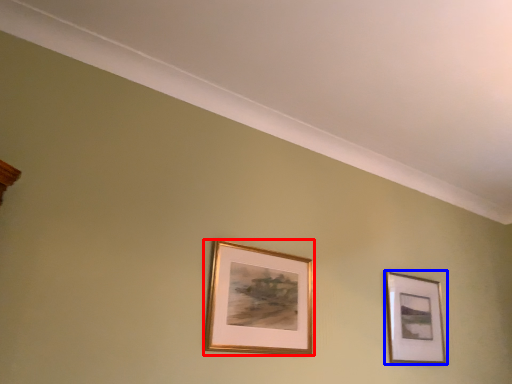
Question: Which of the following is the farthest to the observer, picture frame (highlighted by a red box) or picture frame (highlighted by a blue box)?

Choices:
 (A) picture frame
 (B) picture frame

Answer: (B)